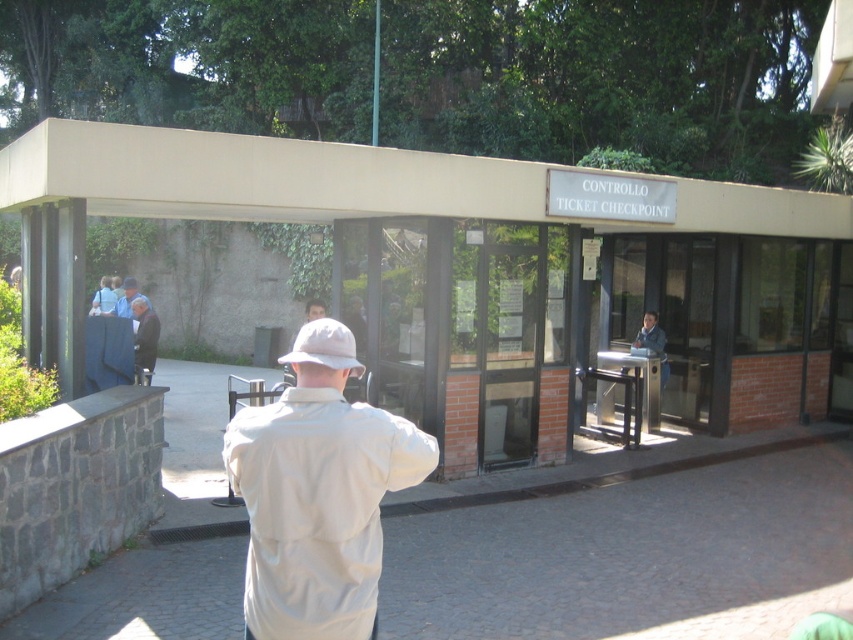
You are a photographer trying to capture a clear shot of the checkpoint. You notice a white matte baseball hat at center and a light brown leather jacket at center blocking your view. Which object is wider and might be causing more obstruction?

The white matte baseball hat at center is wider than the light brown leather jacket at center, so it might be causing more obstruction.

You are a visitor at the ticket checkpoint and you see the beige fabric jacket at center and the white matte baseball hat at center. Which object is closer to the checkpoint entrance?

The beige fabric jacket at center is positioned under the white matte baseball hat at center, meaning it is closer to the checkpoint entrance than the hat.

You are a tour guide leading a group to the ticket checkpoint. You notice a beige fabric jacket at center and a white matte baseball hat at center. If your group needs to form a line between these two items, how far apart should they stand to maintain a safe distance of 1.2 meters between each person?

The distance between the beige fabric jacket at center and the white matte baseball hat at center is 1.16 meters. Since the required safe distance is 1.2 meters, the group should stand slightly further apart than the space between these two items to maintain the recommended distance.